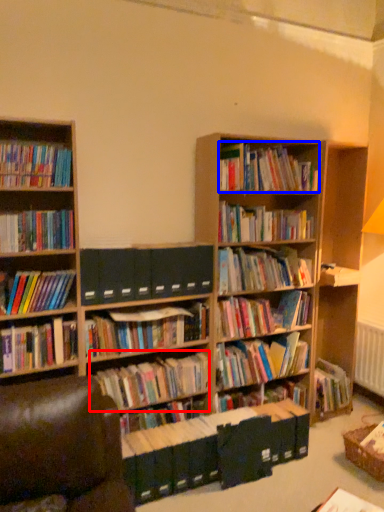
Question: Which object appears closest to the camera in this image, book (highlighted by a red box) or book (highlighted by a blue box)?

Choices:
 (A) book
 (B) book

Answer: (A)